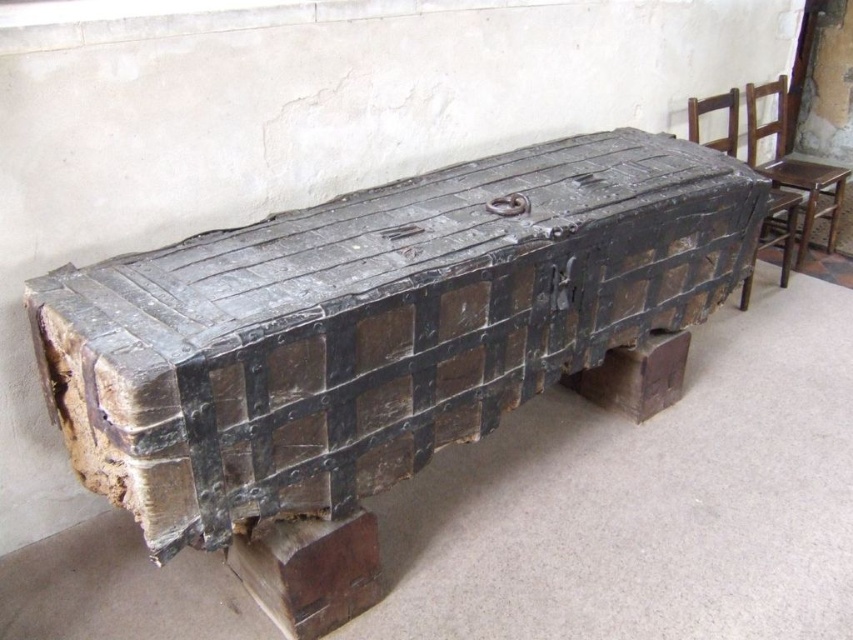
Question: Which point is farther to the camera?

Choices:
 (A) (753, 122)
 (B) (735, 138)

Answer: (A)

Question: Is rusty metal trunk at center to the right of wooden chair at right from the viewer's perspective?

Choices:
 (A) no
 (B) yes

Answer: (A)

Question: Which object is closer to the camera taking this photo?

Choices:
 (A) wooden chair at right
 (B) rusty metal trunk at center

Answer: (B)

Question: Is brown wooden chair at right further to the viewer compared to wooden chair at right?

Choices:
 (A) yes
 (B) no

Answer: (A)

Question: Can you confirm if brown wooden chair at right is thinner than dark brown wooden chair at right?

Choices:
 (A) yes
 (B) no

Answer: (B)

Question: Which of these objects is positioned closest to the brown wooden chair at right?

Choices:
 (A) rusty metal trunk at center
 (B) dark brown wooden chair at right
 (C) wooden chair at right

Answer: (C)